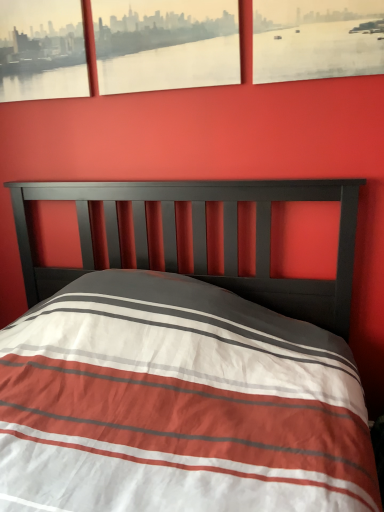
You are a GUI agent. You are given a task and a screenshot of the screen. Output one action in this format:
    pyautogui.click(x=<x>, y=<y>)
    Task: Click on the matte paper picture frame at upper right, the third picture frame when ordered from left to right
    
    Given the screenshot: What is the action you would take?
    pyautogui.click(x=317, y=39)

Who is shorter, matte black picture frame at upper left, the third picture frame viewed from the right, or matte paper picture frame at upper right, which is the 1th picture frame from right to left?

matte paper picture frame at upper right, which is the 1th picture frame from right to left.

Would you say matte paper picture frame at upper right, the third picture frame when ordered from left to right, is part of matte black picture frame at upper left, acting as the first picture frame starting from the left,'s contents?

A: No, matte paper picture frame at upper right, the third picture frame when ordered from left to right, is not surrounded by matte black picture frame at upper left, acting as the first picture frame starting from the left.

Locate an element on the screen. This screenshot has width=384, height=512. the 2nd picture frame positioned above the matte paper picture frame at upper right, the third picture frame when ordered from left to right (from a real-world perspective) is located at coordinates (42, 50).

Would you say matte paper picture frame at upper center, the second picture frame in the right-to-left sequence, is to the left or to the right of matte paper picture frame at upper right, the third picture frame when ordered from left to right, in the picture?

Based on their positions, matte paper picture frame at upper center, the second picture frame in the right-to-left sequence, is located to the left of matte paper picture frame at upper right, the third picture frame when ordered from left to right.

Is matte paper picture frame at upper center, the 2th picture frame viewed from the left, wider or thinner than matte paper picture frame at upper right, which is the 1th picture frame from right to left?

Considering their sizes, matte paper picture frame at upper center, the 2th picture frame viewed from the left, looks broader than matte paper picture frame at upper right, which is the 1th picture frame from right to left.

Are matte paper picture frame at upper center, the 2th picture frame viewed from the left, and matte paper picture frame at upper right, which is the 1th picture frame from right to left, making contact?

matte paper picture frame at upper center, the 2th picture frame viewed from the left, and matte paper picture frame at upper right, which is the 1th picture frame from right to left, are clearly separated.

The image size is (384, 512). I want to click on picture frame that appears in front of the matte paper picture frame at upper center, the 2th picture frame viewed from the left, so click(x=317, y=39).

Who is more distant, matte paper picture frame at upper right, which is the 1th picture frame from right to left, or matte black picture frame at upper left, the third picture frame viewed from the right?

matte black picture frame at upper left, the third picture frame viewed from the right, is further from the camera.

How many degrees apart are the facing directions of matte paper picture frame at upper right, the third picture frame when ordered from left to right, and matte black picture frame at upper left, the third picture frame viewed from the right?

0.475 degrees.

Are matte paper picture frame at upper right, which is the 1th picture frame from right to left, and matte black picture frame at upper left, acting as the first picture frame starting from the left, far apart?

No, matte paper picture frame at upper right, which is the 1th picture frame from right to left, is not far from matte black picture frame at upper left, acting as the first picture frame starting from the left.

Considering the positions of point (375, 71) and point (4, 7), is point (375, 71) closer or farther from the camera than point (4, 7)?

Point (375, 71) appears to be closer to the viewer than point (4, 7).

Is matte black picture frame at upper left, acting as the first picture frame starting from the left, oriented towards matte paper picture frame at upper center, the second picture frame in the right-to-left sequence?

No.

What's the angular difference between matte black picture frame at upper left, acting as the first picture frame starting from the left, and matte paper picture frame at upper center, the 2th picture frame viewed from the left,'s facing directions?

The facing directions of matte black picture frame at upper left, acting as the first picture frame starting from the left, and matte paper picture frame at upper center, the 2th picture frame viewed from the left, are 0.475 degrees apart.

Consider the image. Which object is closer to the camera taking this photo, matte black picture frame at upper left, acting as the first picture frame starting from the left, or matte paper picture frame at upper center, the second picture frame in the right-to-left sequence?

matte paper picture frame at upper center, the second picture frame in the right-to-left sequence, is in front.

Considering the relative positions of matte black picture frame at upper left, acting as the first picture frame starting from the left, and matte paper picture frame at upper center, the 2th picture frame viewed from the left, in the image provided, is matte black picture frame at upper left, acting as the first picture frame starting from the left, to the left of matte paper picture frame at upper center, the 2th picture frame viewed from the left, from the viewer's perspective?

Result: Yes, matte black picture frame at upper left, acting as the first picture frame starting from the left, is to the left of matte paper picture frame at upper center, the 2th picture frame viewed from the left.

From the image's perspective, is matte paper picture frame at upper center, the second picture frame in the right-to-left sequence, above matte black picture frame at upper left, the third picture frame viewed from the right?

No, from the image's perspective, matte paper picture frame at upper center, the second picture frame in the right-to-left sequence, is not above matte black picture frame at upper left, the third picture frame viewed from the right.

Looking at their sizes, would you say matte paper picture frame at upper center, the second picture frame in the right-to-left sequence, is wider or thinner than matte black picture frame at upper left, acting as the first picture frame starting from the left?

Considering their sizes, matte paper picture frame at upper center, the second picture frame in the right-to-left sequence, looks broader than matte black picture frame at upper left, acting as the first picture frame starting from the left.

Which point is more distant from viewer, (x=138, y=54) or (x=47, y=71)?

The point (x=47, y=71) is behind.

Measure the distance between matte paper picture frame at upper center, the 2th picture frame viewed from the left, and matte black picture frame at upper left, the third picture frame viewed from the right.

A distance of 11.23 inches exists between matte paper picture frame at upper center, the 2th picture frame viewed from the left, and matte black picture frame at upper left, the third picture frame viewed from the right.

Considering the sizes of objects matte paper picture frame at upper right, which is the 1th picture frame from right to left, and matte paper picture frame at upper center, the second picture frame in the right-to-left sequence, in the image provided, who is thinner, matte paper picture frame at upper right, which is the 1th picture frame from right to left, or matte paper picture frame at upper center, the second picture frame in the right-to-left sequence,?

matte paper picture frame at upper right, which is the 1th picture frame from right to left, is thinner.

Is matte paper picture frame at upper right, the third picture frame when ordered from left to right, not within matte paper picture frame at upper center, the second picture frame in the right-to-left sequence?

Yes, matte paper picture frame at upper right, the third picture frame when ordered from left to right, is not within matte paper picture frame at upper center, the second picture frame in the right-to-left sequence.

Is matte paper picture frame at upper right, the third picture frame when ordered from left to right, facing towards matte paper picture frame at upper center, the 2th picture frame viewed from the left?

No, matte paper picture frame at upper right, the third picture frame when ordered from left to right, is not oriented towards matte paper picture frame at upper center, the 2th picture frame viewed from the left.

You are a GUI agent. You are given a task and a screenshot of the screen. Output one action in this format:
    pyautogui.click(x=<x>, y=<y>)
    Task: Click on the picture frame that is in front of the matte paper picture frame at upper center, the 2th picture frame viewed from the left
    This screenshot has width=384, height=512.
    Given the screenshot: What is the action you would take?
    pyautogui.click(x=317, y=39)

Starting from the matte paper picture frame at upper right, the third picture frame when ordered from left to right, which picture frame is the 2nd one to the left? Please provide its 2D coordinates.

[(42, 50)]

I want to click on picture frame directly beneath the matte paper picture frame at upper center, the second picture frame in the right-to-left sequence (from a real-world perspective), so click(317, 39).

From the image, which object appears to be farther from matte black picture frame at upper left, acting as the first picture frame starting from the left, matte paper picture frame at upper right, the third picture frame when ordered from left to right, or matte paper picture frame at upper center, the 2th picture frame viewed from the left?

matte paper picture frame at upper right, the third picture frame when ordered from left to right, is positioned further to the anchor matte black picture frame at upper left, acting as the first picture frame starting from the left.

Looking at the image, which one is located closer to matte paper picture frame at upper right, which is the 1th picture frame from right to left, matte paper picture frame at upper center, the 2th picture frame viewed from the left, or matte black picture frame at upper left, acting as the first picture frame starting from the left?

Based on the image, matte paper picture frame at upper center, the 2th picture frame viewed from the left, appears to be nearer to matte paper picture frame at upper right, which is the 1th picture frame from right to left.

Based on their spatial positions, is matte paper picture frame at upper center, the second picture frame in the right-to-left sequence, or matte paper picture frame at upper right, which is the 1th picture frame from right to left, closer to matte black picture frame at upper left, acting as the first picture frame starting from the left?

matte paper picture frame at upper center, the second picture frame in the right-to-left sequence, is positioned closer to the anchor matte black picture frame at upper left, acting as the first picture frame starting from the left.

Based on their spatial positions, is matte paper picture frame at upper right, the third picture frame when ordered from left to right, or matte black picture frame at upper left, the third picture frame viewed from the right, closer to matte paper picture frame at upper center, the second picture frame in the right-to-left sequence?

matte black picture frame at upper left, the third picture frame viewed from the right, is positioned closer to the anchor matte paper picture frame at upper center, the second picture frame in the right-to-left sequence.

From the image, which object appears to be farther from matte paper picture frame at upper right, which is the 1th picture frame from right to left, matte black picture frame at upper left, the third picture frame viewed from the right, or matte paper picture frame at upper center, the second picture frame in the right-to-left sequence?

The object further to matte paper picture frame at upper right, which is the 1th picture frame from right to left, is matte black picture frame at upper left, the third picture frame viewed from the right.

From the image, which object appears to be farther from matte paper picture frame at upper center, the 2th picture frame viewed from the left, matte black picture frame at upper left, acting as the first picture frame starting from the left, or matte paper picture frame at upper right, which is the 1th picture frame from right to left?

matte paper picture frame at upper right, which is the 1th picture frame from right to left, is further to matte paper picture frame at upper center, the 2th picture frame viewed from the left.

The width and height of the screenshot is (384, 512). Identify the location of picture frame between matte black picture frame at upper left, the third picture frame viewed from the right, and matte paper picture frame at upper right, which is the 1th picture frame from right to left. click(165, 44).